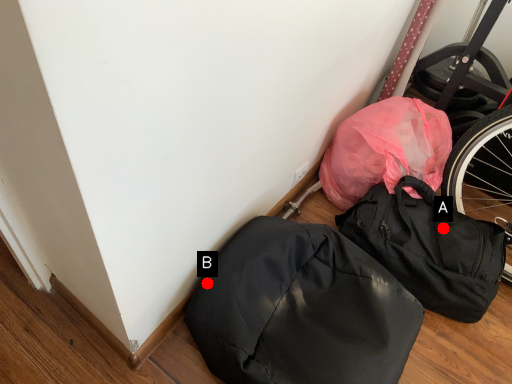
Question: Two points are circled on the image, labeled by A and B beside each circle. Which point is further to the camera?

Choices:
 (A) A is further
 (B) B is further

Answer: (A)